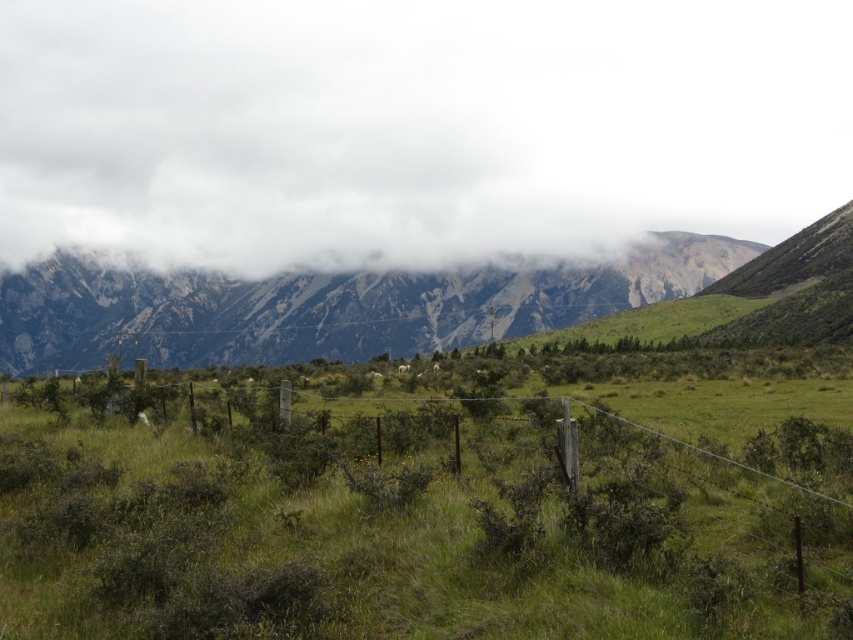
At what (x,y) coordinates should I click in order to perform the action: click on white fluffy cloud at upper center. Please return your answer as a coordinate pair (x, y). Looking at the image, I should click on click(x=413, y=129).

You are a GUI agent. You are given a task and a screenshot of the screen. Output one action in this format:
    pyautogui.click(x=<x>, y=<y>)
    Task: Click on the white fluffy cloud at upper center
    Image resolution: width=853 pixels, height=640 pixels.
    Given the screenshot: What is the action you would take?
    pyautogui.click(x=413, y=129)

Who is more forward, (554,244) or (4,362)?

Point (554,244)

Is the position of white fluffy cloud at upper center less distant than that of rugged stone mountain range at center?

No.

Between point (263, 186) and point (90, 308), which one is positioned in front?

Point (90, 308)

Where is `white fluffy cloud at upper center`? The width and height of the screenshot is (853, 640). white fluffy cloud at upper center is located at coordinates (413, 129).

Does green grassy at center appear over rugged stone mountain range at center?

Actually, green grassy at center is below rugged stone mountain range at center.

Does green grassy at center have a smaller size compared to rugged stone mountain range at center?

Yes, green grassy at center is smaller than rugged stone mountain range at center.

Which is behind, point (770, 552) or point (599, 266)?

Positioned behind is point (599, 266).

Locate an element on the screen. This screenshot has height=640, width=853. green grassy at center is located at coordinates (401, 534).